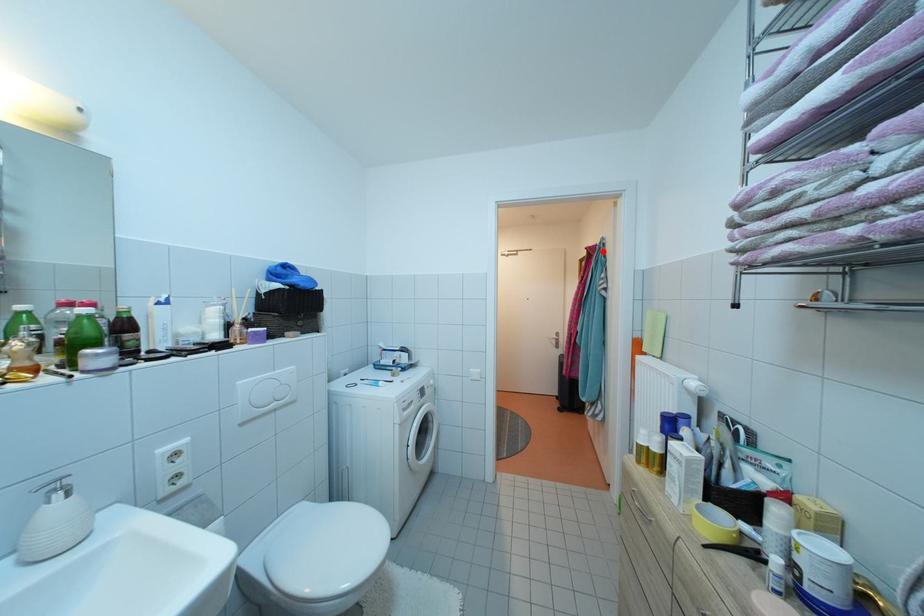
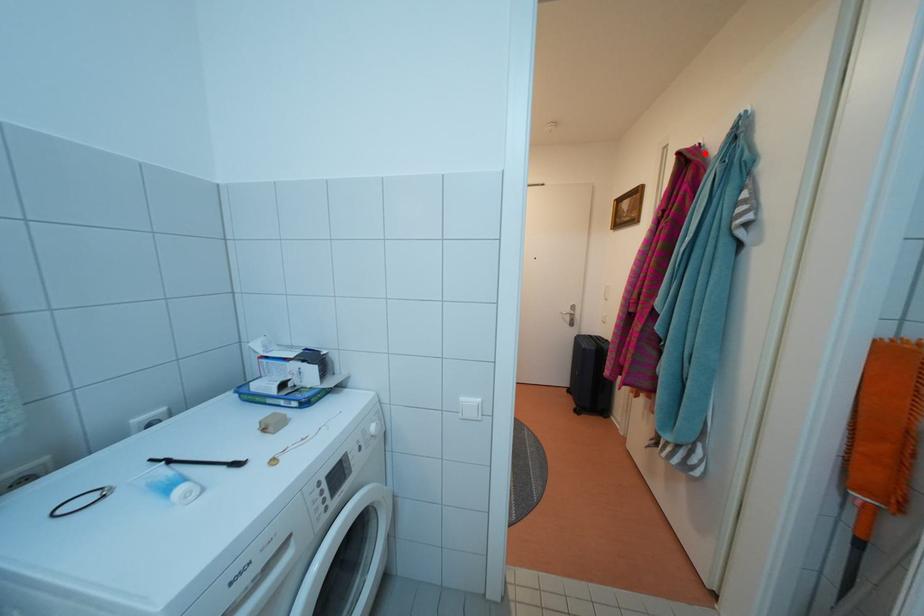
I am providing you with two images of the same scene from different viewpoints. A red point is marked on the first image and another point is marked on the second image. Is the red point in image1 aligned with the point shown in image2?

Yes